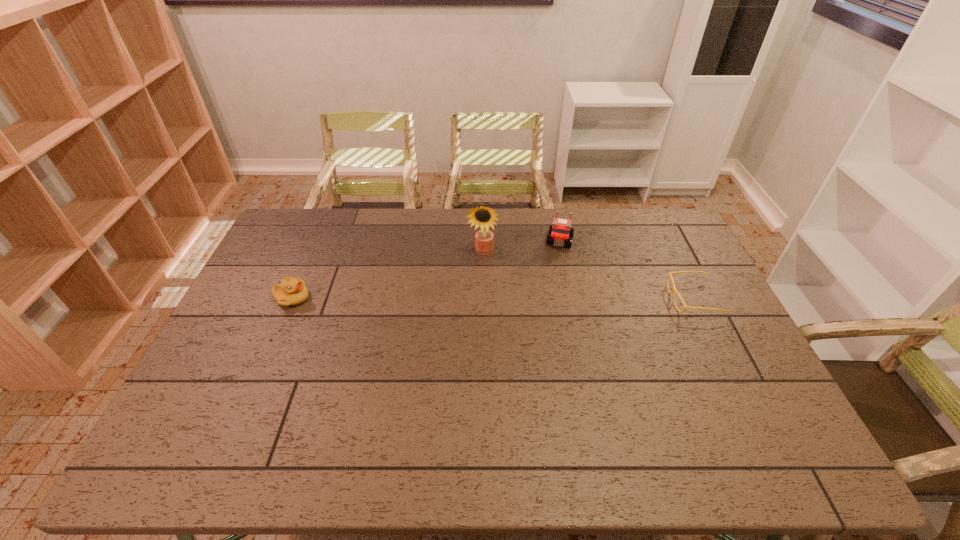
Locate an element on the screen. This screenshot has height=540, width=960. object positioned at the left edge is located at coordinates (292, 291).

This screenshot has width=960, height=540. In order to click on object located in the right edge section of the desktop in this screenshot , I will do point(674,288).

Locate an element on the screen. free space at the far edge of the desktop is located at coordinates (617, 234).

Image resolution: width=960 pixels, height=540 pixels. I want to click on vacant area at the near edge of the desktop, so [536, 408].

Where is `free region at the left edge of the desktop`? free region at the left edge of the desktop is located at coordinates (265, 341).

This screenshot has width=960, height=540. In the image, there is a desktop. Find the location of `vacant space at the right edge`. vacant space at the right edge is located at coordinates (735, 372).

Locate an element on the screen. Image resolution: width=960 pixels, height=540 pixels. vacant space at the far left corner of the desktop is located at coordinates (305, 229).

In the image, there is a desktop. Identify the location of vacant space at the far right corner. The width and height of the screenshot is (960, 540). (684, 233).

You are a GUI agent. You are given a task and a screenshot of the screen. Output one action in this format:
    pyautogui.click(x=<x>, y=<y>)
    Task: Click on the vacant point located between the duckling and the Lego
    
    Given the screenshot: What is the action you would take?
    pyautogui.click(x=426, y=269)

Identify the location of vacant space that's between the leftmost object and the shortest object. (492, 299).